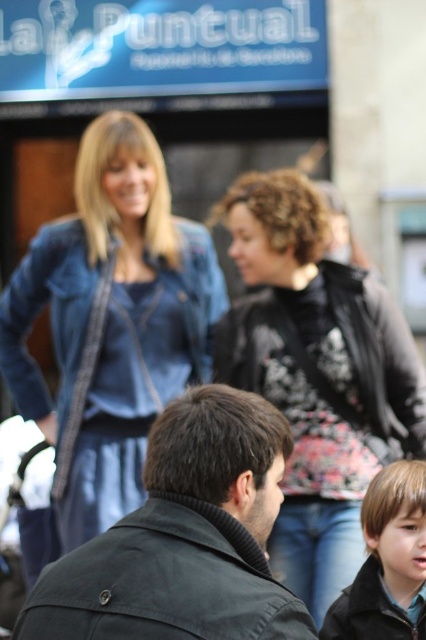
Question: Based on their relative distances, which object is farther from the black matte jacket at lower right?

Choices:
 (A) floral-patterned fabric at center
 (B) denim jacket at upper center
 (C) smooth black jacket at lower right

Answer: (B)

Question: Which of the following is the closest to the observer?

Choices:
 (A) dark green jacket at center
 (B) denim jacket at upper center
 (C) black matte jacket at lower right
 (D) floral-patterned fabric at center

Answer: (A)

Question: Among these objects, which one is nearest to the camera?

Choices:
 (A) dark green jacket at center
 (B) smooth black jacket at lower right

Answer: (A)

Question: Where is denim jacket at upper center located in relation to floral-patterned fabric at center in the image?

Choices:
 (A) right
 (B) left

Answer: (B)

Question: Considering the relative positions of denim jacket at upper center and smooth black jacket at lower right in the image provided, where is denim jacket at upper center located with respect to smooth black jacket at lower right?

Choices:
 (A) above
 (B) below

Answer: (A)

Question: Is floral-patterned fabric at center wider than smooth black jacket at lower right?

Choices:
 (A) yes
 (B) no

Answer: (A)